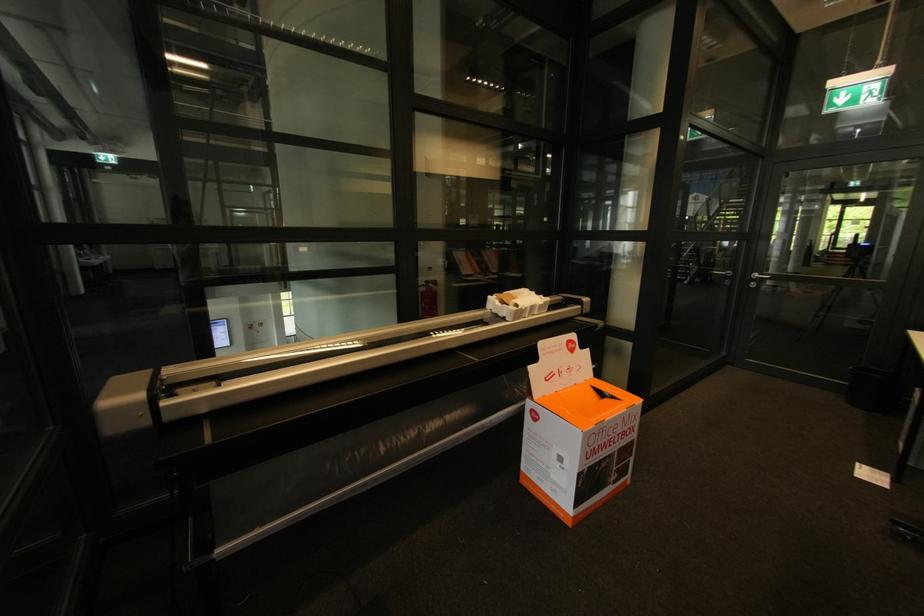
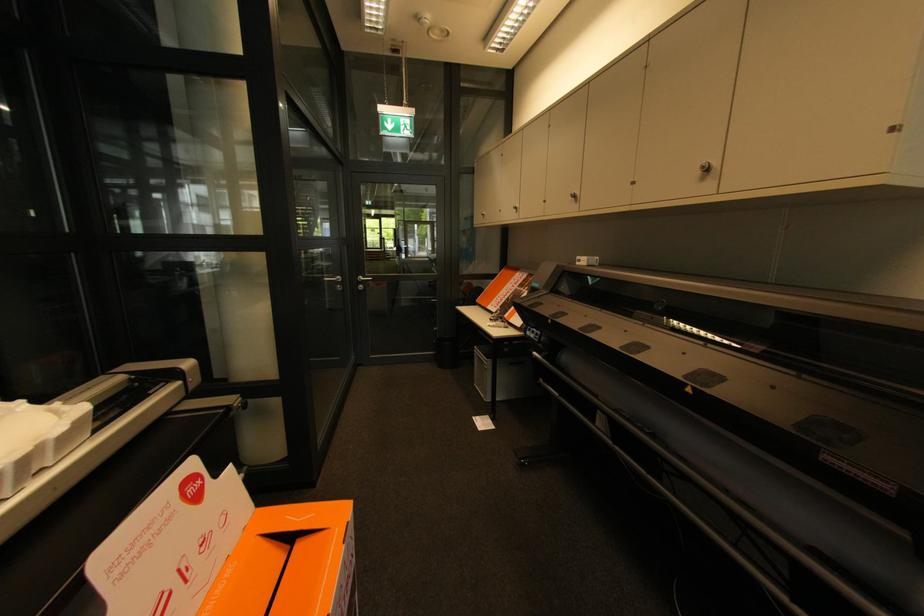
Find the pixel in the second image that matches (757,285) in the first image.

(365, 286)